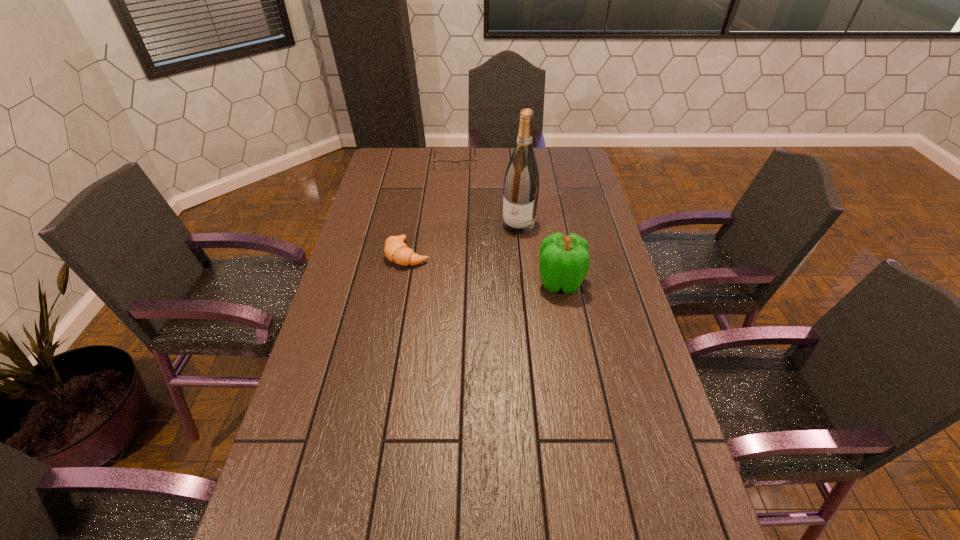
Identify the location of vacant space on the desktop that is between the crescent roll and the third shortest object and is positioned on the label of the third nearest object. (493, 270).

You are a GUI agent. You are given a task and a screenshot of the screen. Output one action in this format:
    pyautogui.click(x=<x>, y=<y>)
    Task: Click on the vacant space on the desktop that is between the second shortest object and the second tallest object and is positioned on the front-facing side of the shortest object
    
    Given the screenshot: What is the action you would take?
    pyautogui.click(x=462, y=264)